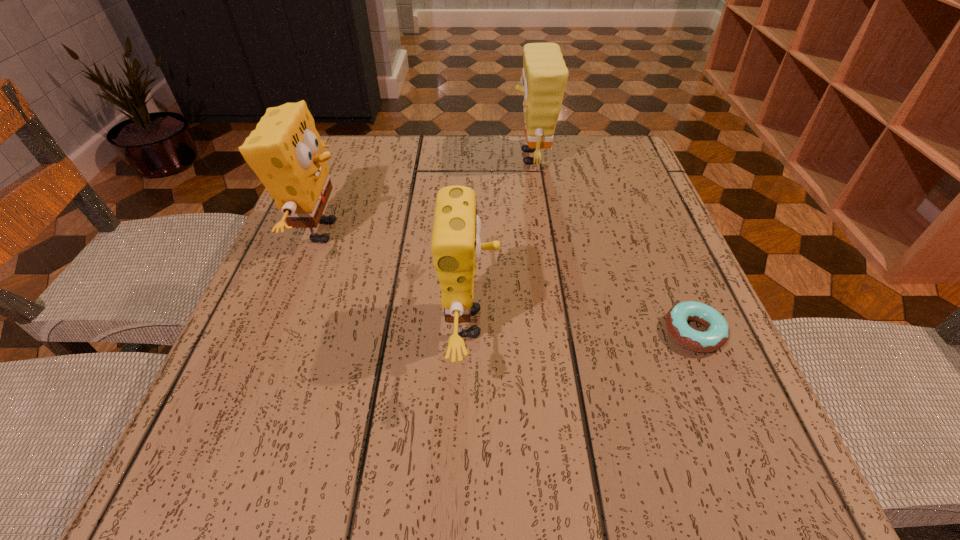
The height and width of the screenshot is (540, 960). Find the location of `vacant position located on the face of the second sponge from right to left`. vacant position located on the face of the second sponge from right to left is located at coordinates (553, 323).

This screenshot has width=960, height=540. Find the location of `free space located 0.120m on the front of the rightmost object`. free space located 0.120m on the front of the rightmost object is located at coordinates (735, 433).

Locate an element on the screen. The width and height of the screenshot is (960, 540). object at the far edge is located at coordinates (544, 76).

Identify the location of object that is at the left edge. (285, 152).

You are a GUI agent. You are given a task and a screenshot of the screen. Output one action in this format:
    pyautogui.click(x=<x>, y=<y>)
    Task: Click on the object at the right edge
    This screenshot has width=960, height=540.
    Given the screenshot: What is the action you would take?
    pyautogui.click(x=716, y=335)

Locate an element on the screen. free space at the far edge of the desktop is located at coordinates 406,152.

The image size is (960, 540). In the image, there is a desktop. What are the coordinates of `vacant space at the left edge` in the screenshot? It's located at (336, 255).

At what (x,y) coordinates should I click in order to perform the action: click on vacant region at the right edge of the desktop. Please return your answer as a coordinate pair (x, y). The width and height of the screenshot is (960, 540). Looking at the image, I should click on (643, 220).

The width and height of the screenshot is (960, 540). In the image, there is a desktop. In order to click on free space at the far left corner in this screenshot , I will do `click(331, 145)`.

At what (x,y) coordinates should I click in order to perform the action: click on free point at the far right corner. Please return your answer as a coordinate pair (x, y). The height and width of the screenshot is (540, 960). Looking at the image, I should click on (590, 159).